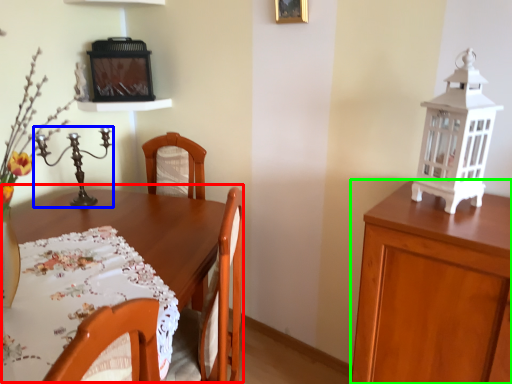
Question: Which object is positioned closest to table (highlighted by a red box)? Select from candle holder (highlighted by a blue box) and cabinetry (highlighted by a green box).

Choices:
 (A) candle holder
 (B) cabinetry

Answer: (A)